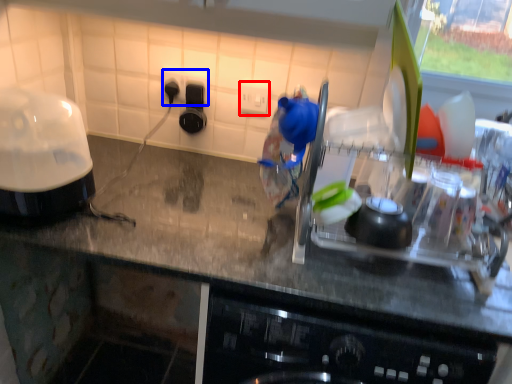
Question: Which object appears closest to the camera in this image, electric outlet (highlighted by a red box) or electric outlet (highlighted by a blue box)?

Choices:
 (A) electric outlet
 (B) electric outlet

Answer: (A)